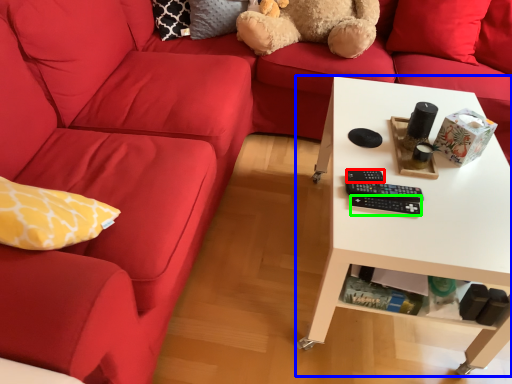
Question: Considering the real-world distances, which object is farthest from control (highlighted by a red box)? table (highlighted by a blue box) or control (highlighted by a green box)?

Choices:
 (A) table
 (B) control

Answer: (A)